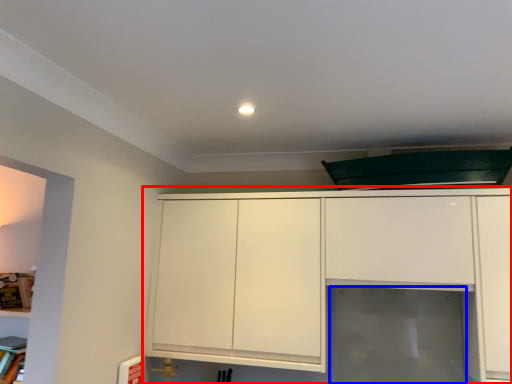
Question: Which object appears farthest to the camera in this image, cabinetry (highlighted by a red box) or glass door (highlighted by a blue box)?

Choices:
 (A) cabinetry
 (B) glass door

Answer: (B)